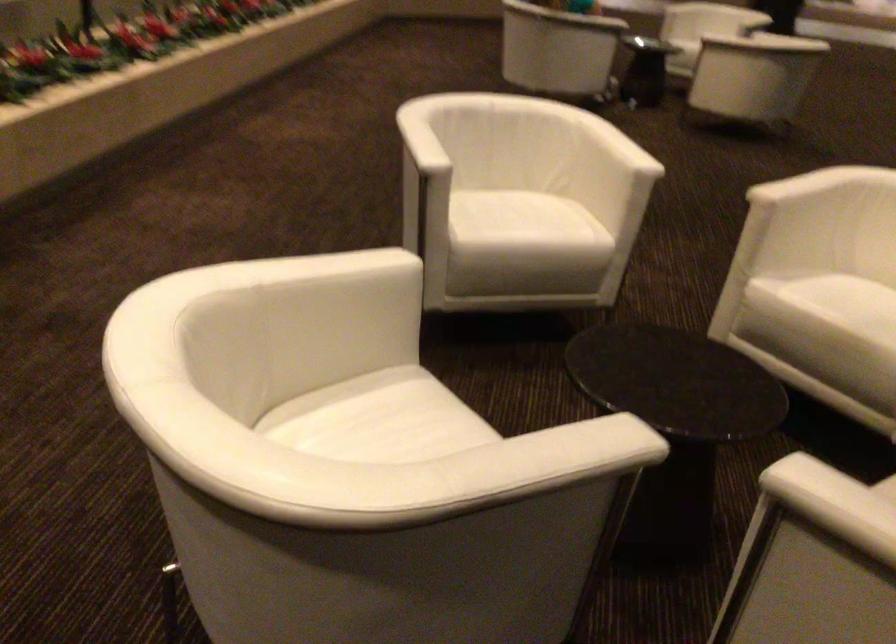
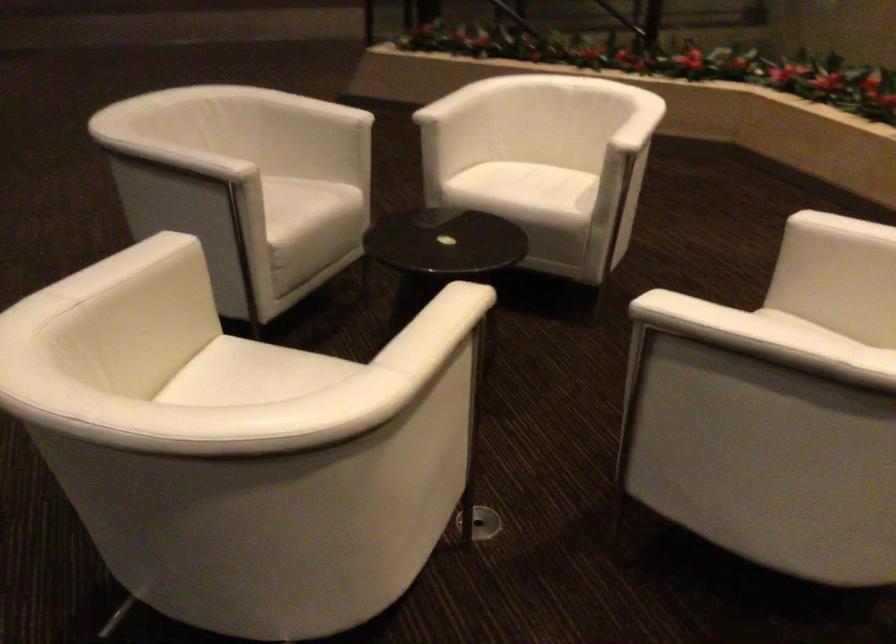
Where in the second image is the point corresponding to (x=799, y=182) from the first image?

(437, 308)